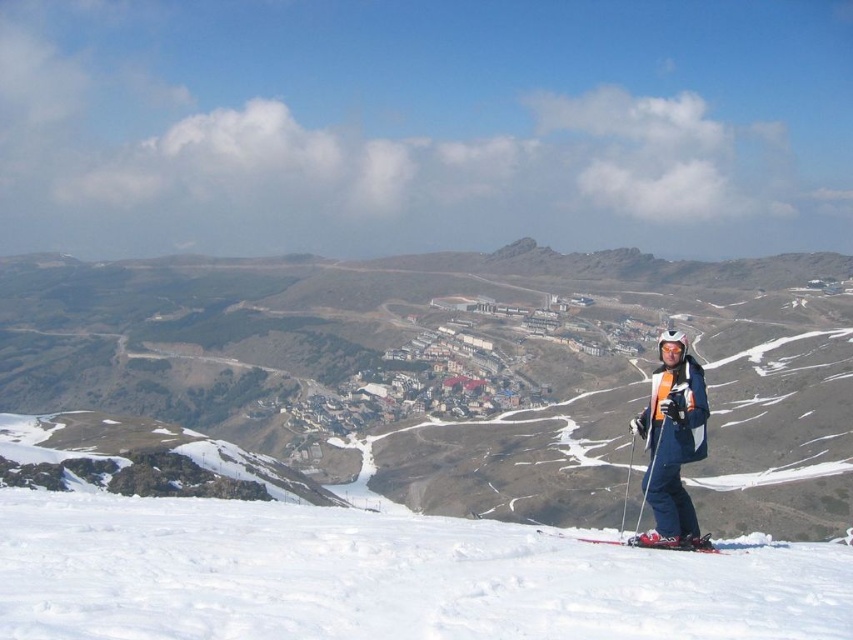
You are a photographer trying to capture the scene with a camera that has a limited depth of field. You want to focus on the blue fabric ski suit at lower right and the shiny metallic ski at lower center. Which object should you focus on if you want the thinner one to be in sharp focus?

You should focus on the blue fabric ski suit at lower right because it is thinner than the shiny metallic ski at lower center, so focusing on the thinner object will ensure it is in sharp focus.

You are a photographer trying to capture the blue fabric ski suit at lower right and the shiny metallic ski at lower center in the same frame. Which object should you focus on first to ensure both are in the frame without moving the camera?

The blue fabric ski suit at lower right is larger in size than the shiny metallic ski at lower center, so you should focus on the shiny metallic ski at lower center first to ensure both fit in the frame.